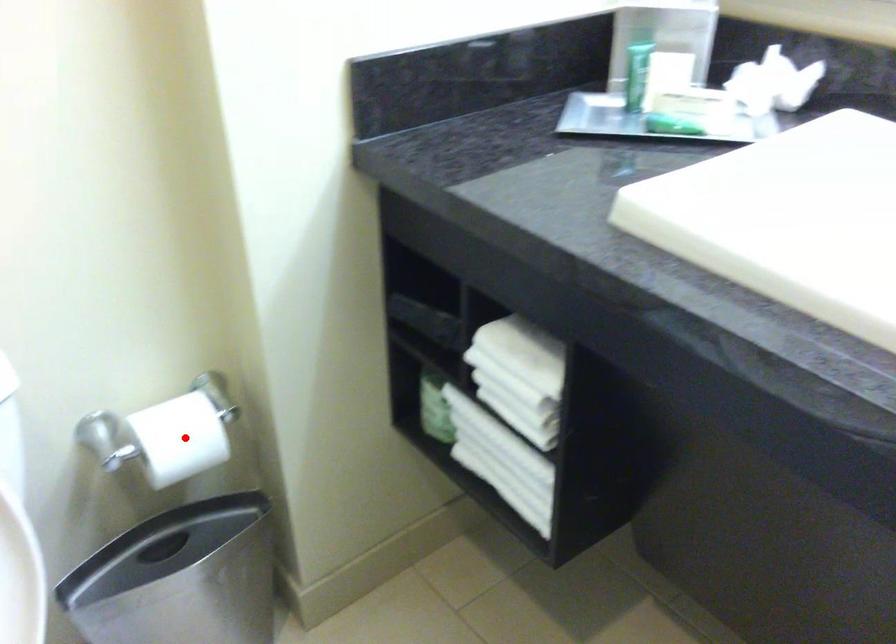
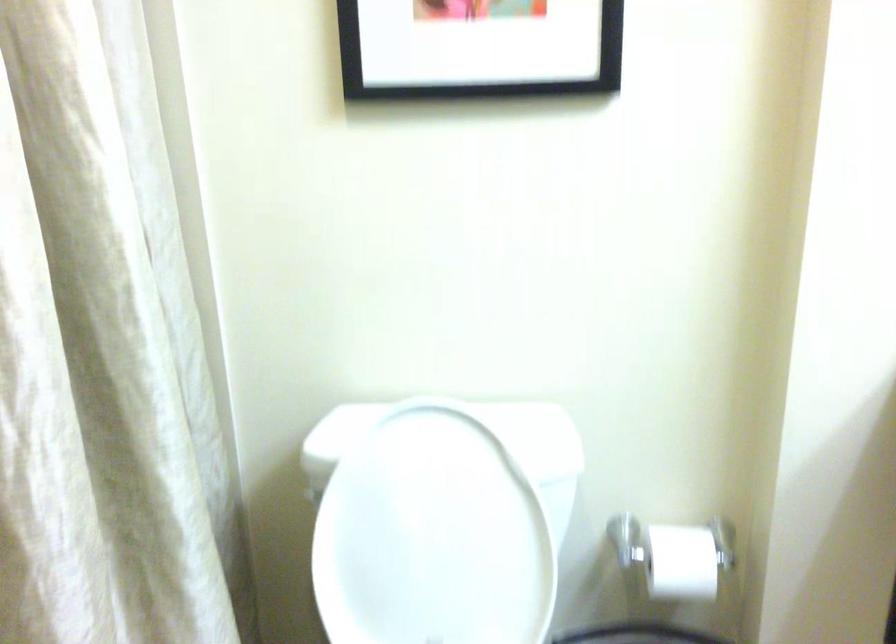
Locate, in the second image, the point that corresponds to the highlighted location in the first image.

(682, 562)